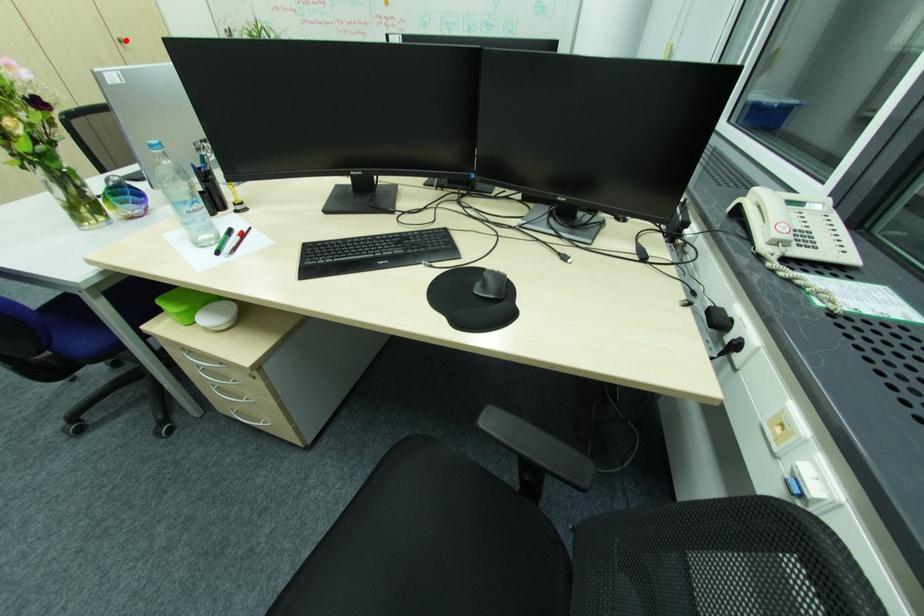
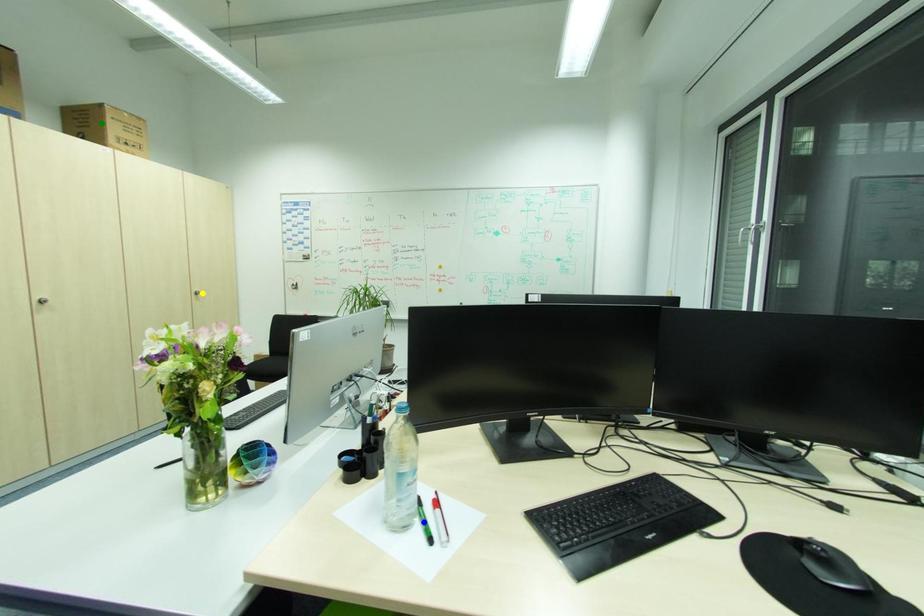
Question: I am providing you with two images of the same scene from different viewpoints. A red point is marked on the first image. You are given multiple points on the second image. Which point in image 2 is actually the same real-world point as the red point in image 1?

Choices:
 (A) green point
 (B) blue point
 (C) yellow point

Answer: (C)